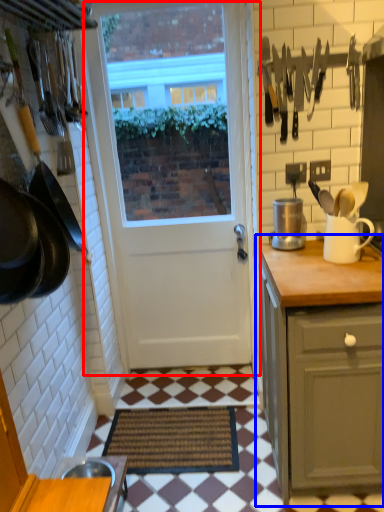
Question: Among these objects, which one is nearest to the camera, door (highlighted by a red box) or cabinetry (highlighted by a blue box)?

Choices:
 (A) door
 (B) cabinetry

Answer: (B)